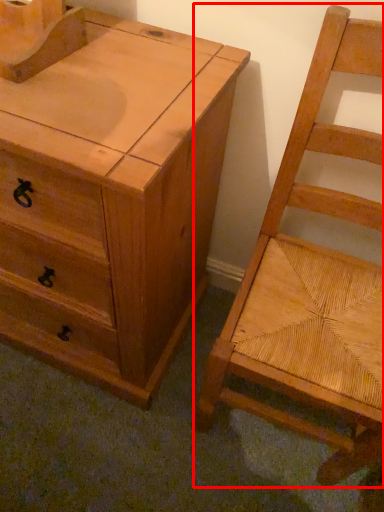
Question: From the image's perspective, where is chair (annotated by the red box) located relative to chest of drawers?

Choices:
 (A) above
 (B) below

Answer: (B)